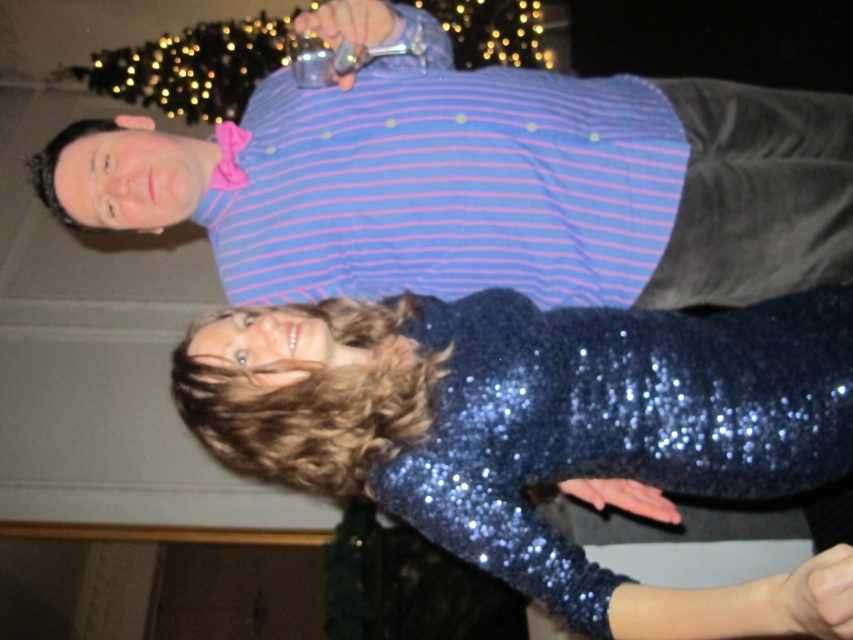
Question: Is blue striped shirt at upper center closer to camera compared to sparkly blue dress at center?

Choices:
 (A) no
 (B) yes

Answer: (A)

Question: Which of the following is the farthest from the observer?

Choices:
 (A) blue striped shirt at upper center
 (B) sparkly blue dress at center

Answer: (A)

Question: Does blue striped shirt at upper center have a lesser width compared to sparkly blue dress at center?

Choices:
 (A) no
 (B) yes

Answer: (A)

Question: Does blue striped shirt at upper center appear on the left side of sparkly blue dress at center?

Choices:
 (A) yes
 (B) no

Answer: (A)

Question: Which object is farther from the camera taking this photo?

Choices:
 (A) blue striped shirt at upper center
 (B) sparkly blue dress at center

Answer: (A)